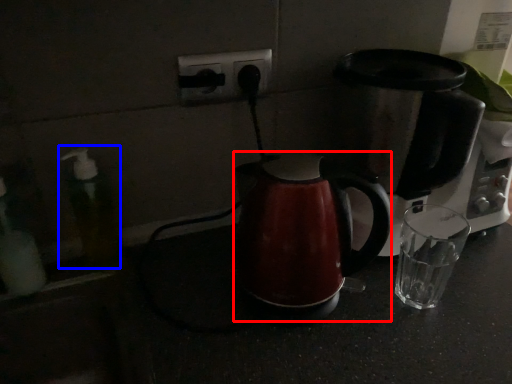
Question: Which object is further to the camera taking this photo, kettle (highlighted by a red box) or soap dispenser (highlighted by a blue box)?

Choices:
 (A) kettle
 (B) soap dispenser

Answer: (B)